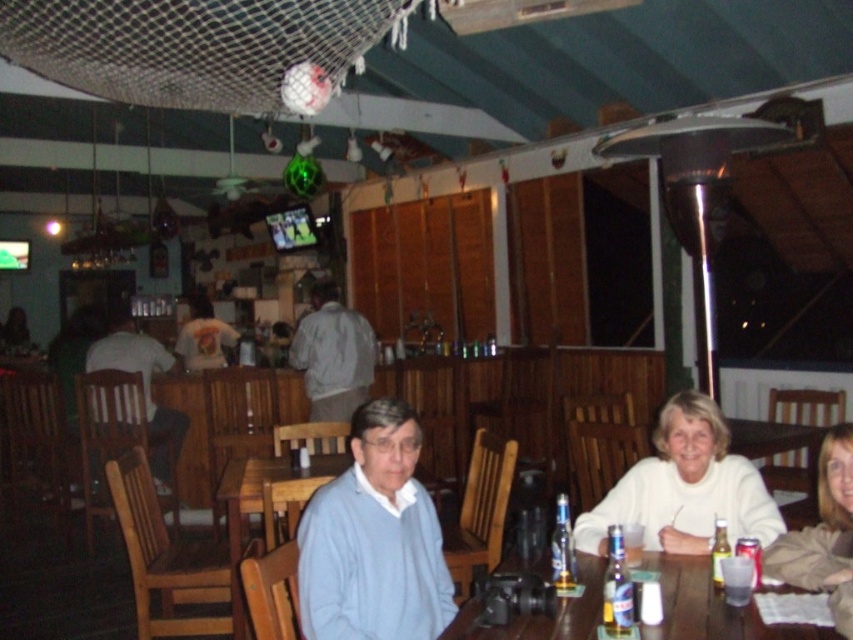
You are a photographer setting up a shoot in this dining area. You need to position a 1.2 meter tall tripod between the white matte sweater at lower right and the gray fabric jacket at center so it doesn t block anyone. Based on their heights, will the tripod s height be an issue?

The white matte sweater at lower right is not as tall as the gray fabric jacket at center. Since the tripod is 1.2 meters tall, and the tallest object between them is the gray fabric jacket at center, the tripod may be taller than the jacket, potentially causing a blockage. Check the jacket s height before placing the tripod.

You are a server in this restaurant and need to place a new menu on the table. The menu is 20 cm wide. There is a gray fabric jacket at center and a clear glass bottle at table center on the table. Can both items and the menu fit side by side on the table without overlapping?

The gray fabric jacket at center is wider than the clear glass bottle at table center. Since the menu is 20 cm wide, the total width required would be the sum of the jacket, bottle, and menu. However, without knowing the exact widths of the jacket and bottle, it is impossible to determine if they can fit side by side on the table without overlapping.

You are a server in the dining establishment and need to deliver a drink to the person wearing the white matte sweater at lower right and the gray fabric jacket at center. Which item should you place the drink closer to the edge of the table to avoid blocking the view of the hanging soccer ball?

The white matte sweater at lower right is closer to the viewer than the gray fabric jacket at center, so place the drink closer to the edge near the white matte sweater at lower right to avoid blocking the view of the hanging soccer ball.